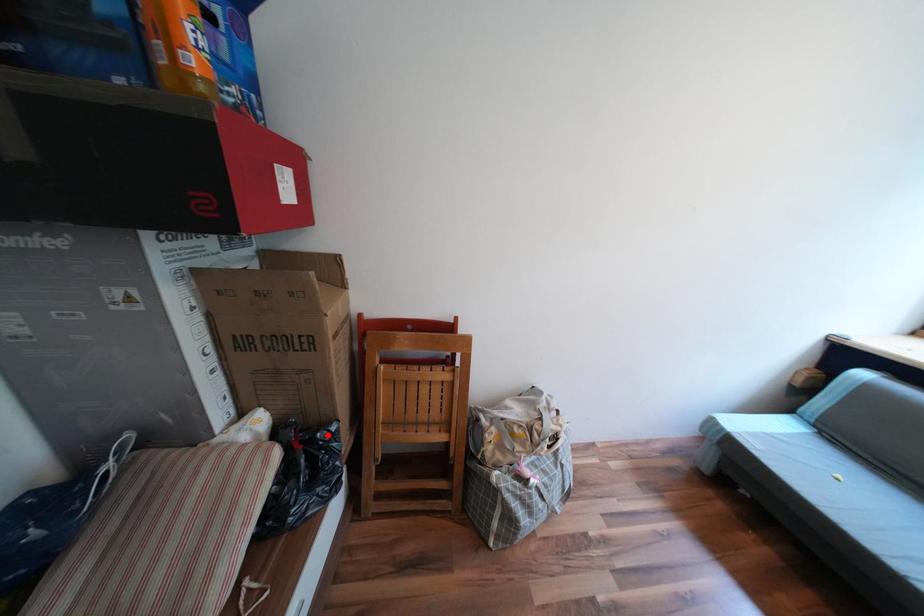
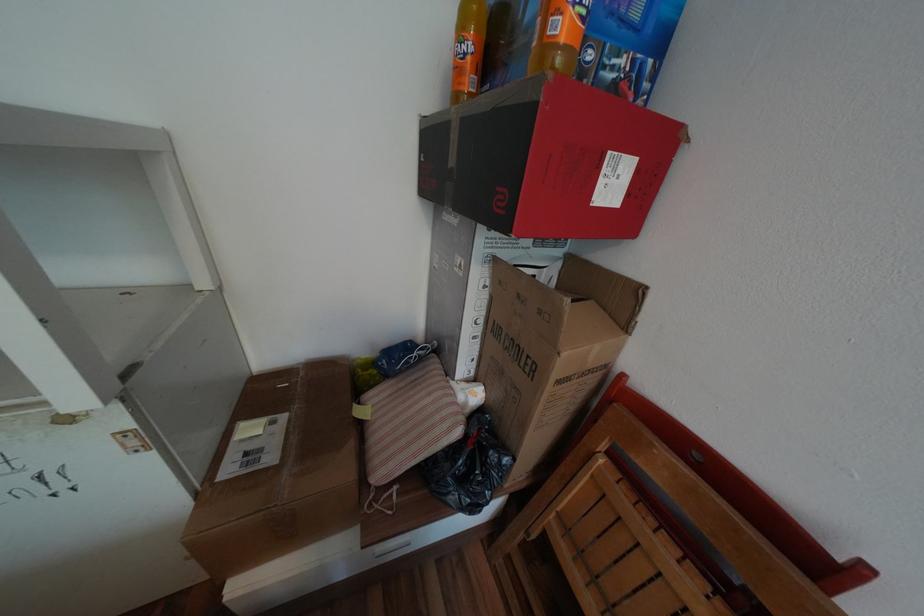
Question: I am providing you with two images of the same scene from different viewpoints. In image1, a red point is highlighted. Considering the same 3D point in image2, which of the following is correct?

Choices:
 (A) It is closer
 (B) It is farther

Answer: (B)